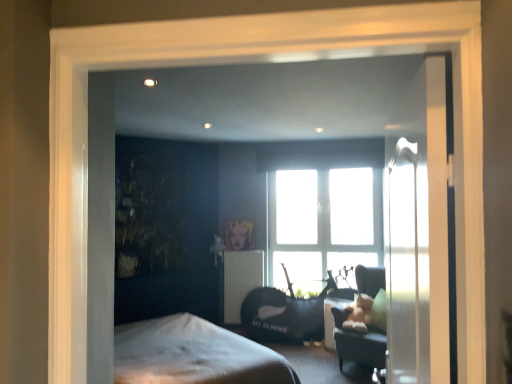
The image size is (512, 384). I want to click on vacant space situated above metallic gold picture frame at center (from a real-world perspective), so click(x=237, y=218).